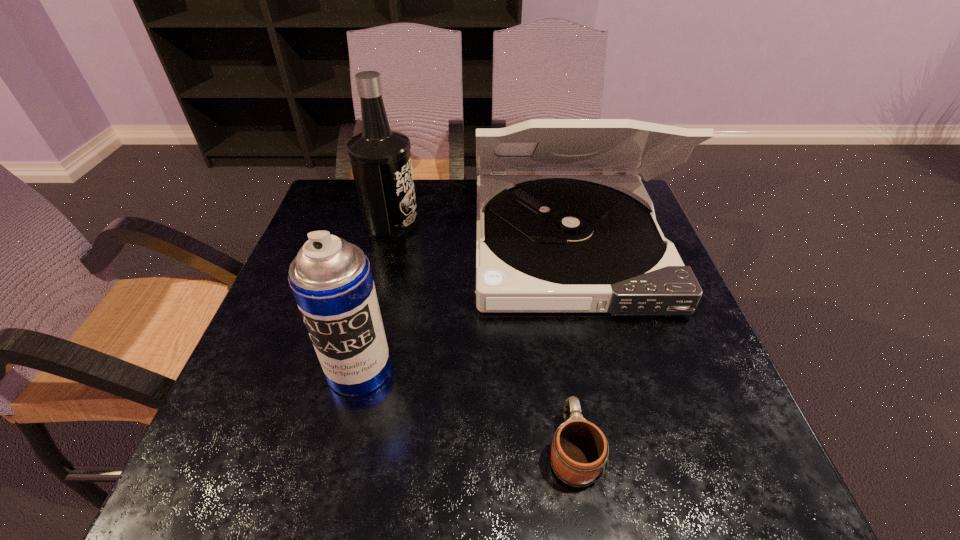
The width and height of the screenshot is (960, 540). Identify the location of free location at the left edge of the desktop. (226, 405).

The width and height of the screenshot is (960, 540). What are the coordinates of `vacant area at the near left corner of the desktop` in the screenshot? It's located at (214, 449).

This screenshot has height=540, width=960. Find the location of `vacant region at the near right corner of the desktop`. vacant region at the near right corner of the desktop is located at coordinates (751, 480).

Where is `unoccupied position between the liquor and the nearest object`? The width and height of the screenshot is (960, 540). unoccupied position between the liquor and the nearest object is located at coordinates (482, 336).

Find the location of a particular element. This screenshot has width=960, height=540. vacant area that lies between the CD player and the mug is located at coordinates (570, 348).

The height and width of the screenshot is (540, 960). I want to click on vacant space in between the liquor and the nearest object, so click(482, 336).

Where is `vacant space that is in between the aerosol can and the CD player`? The image size is (960, 540). vacant space that is in between the aerosol can and the CD player is located at coordinates (464, 308).

Identify the location of vacant area between the CD player and the shortest object. This screenshot has width=960, height=540. (570, 348).

At what (x,y) coordinates should I click in order to perform the action: click on vacant area that lies between the shortest object and the aerosol can. Please return your answer as a coordinate pair (x, y). Image resolution: width=960 pixels, height=540 pixels. Looking at the image, I should click on (466, 410).

Image resolution: width=960 pixels, height=540 pixels. I want to click on vacant space that's between the liquor and the mug, so click(x=482, y=336).